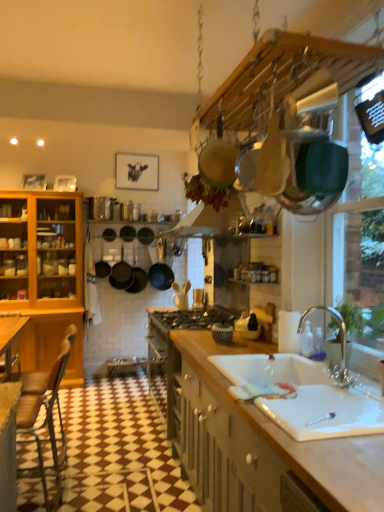
You are a GUI agent. You are given a task and a screenshot of the screen. Output one action in this format:
    pyautogui.click(x=<x>, y=<y>)
    Task: Click on the free point above white ceramic sink at lower center (from a real-world perspective)
    
    Given the screenshot: What is the action you would take?
    pyautogui.click(x=325, y=395)